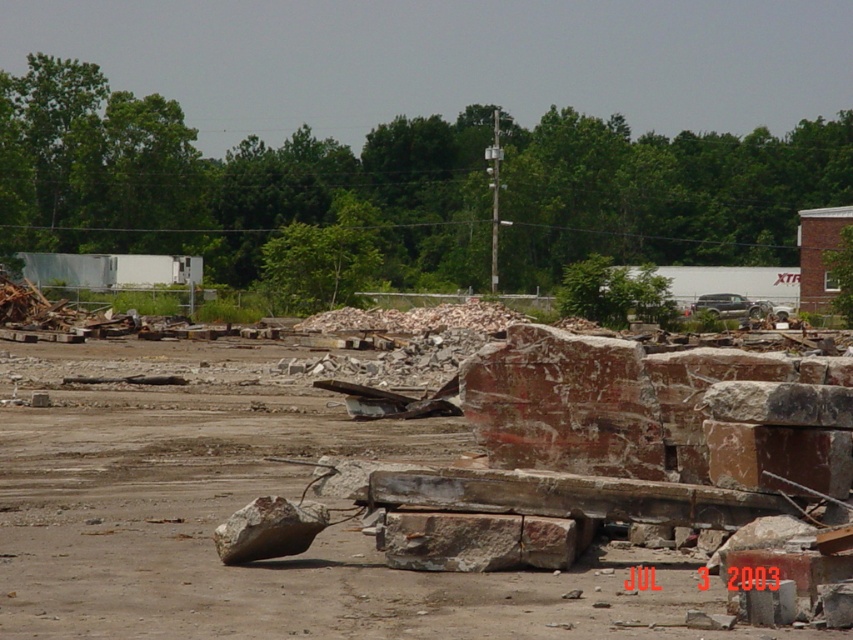
You are a construction worker who needs to move the brown rough stone at center and the rusty stone boulder at lower left. Based on their sizes, which one would require more space to move?

The brown rough stone at center might require more space to move since it is possibly wider than the rusty stone boulder at lower left.

You are a construction worker who needs to move the rusty stone boulder at lower left to the right side of the brown rough stone at center. Which direction should you move it to achieve this?

The rusty stone boulder at lower left is currently to the left of the brown rough stone at center. To move it to the right side of the brown rough stone at center, you should move it to the right.